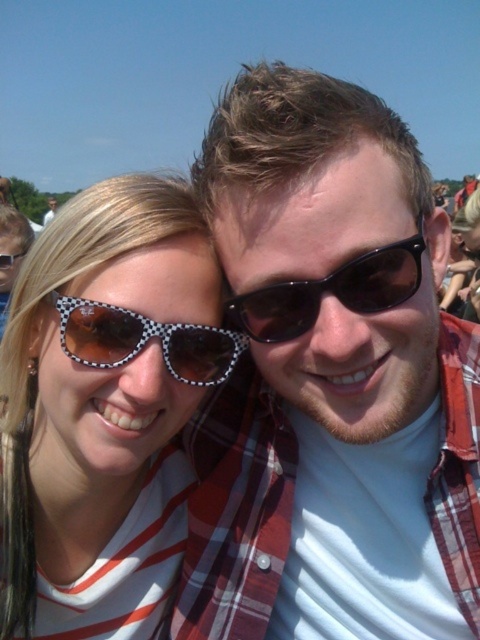
You are standing in front of a photo of two people. You notice two points marked on the image. The first point is at coordinates point (173, 538) and the second is at point (385, 269). Which point is closer to you?

Point (173, 538) is closer to you because it is further to the viewer than point (385, 269).

You are a photographer trying to capture a group photo of the polka dot sunglasses at left and the black textured sunglasses at center. Given that your camera has a depth of field that can focus on objects within 40 centimeters of each other, will both sunglasses be in focus?

The polka dot sunglasses at left is 41.09 centimeters away from the black textured sunglasses at center. Since the distance exceeds the camera s 40 centimeter depth of field range, the two sunglasses will not both be in focus.